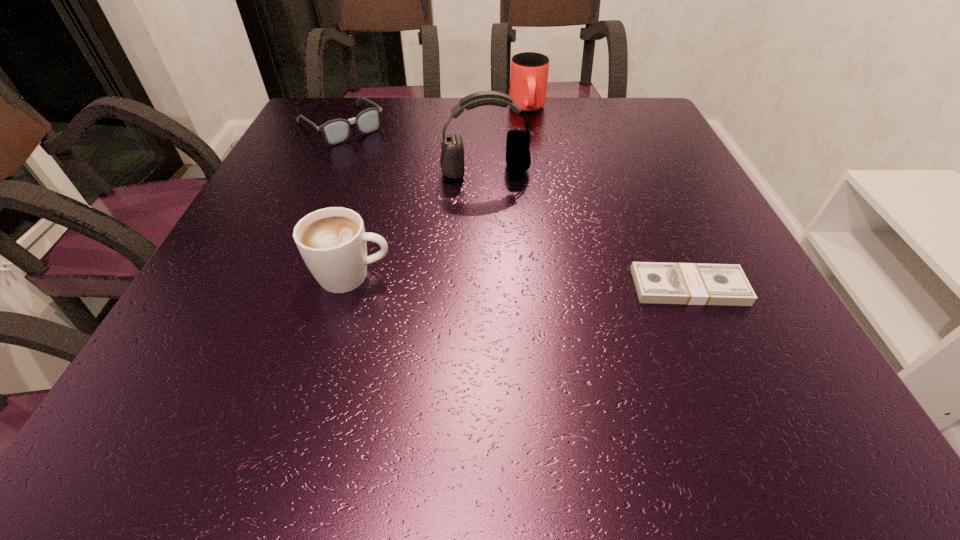
Locate an element on the screen. This screenshot has height=540, width=960. free point between the third farthest object and the spectacles is located at coordinates (414, 148).

Identify the location of vacant space that is in between the cup and the rightmost object. (608, 198).

Where is `free spot between the headset and the spectacles`? Image resolution: width=960 pixels, height=540 pixels. free spot between the headset and the spectacles is located at coordinates (414, 148).

This screenshot has height=540, width=960. I want to click on free space between the dollar and the cup, so click(608, 198).

Identify the location of free space between the cup and the cappuccino. This screenshot has height=540, width=960. (440, 193).

This screenshot has height=540, width=960. Find the location of `free space between the spectacles and the tallest object`. free space between the spectacles and the tallest object is located at coordinates (414, 148).

Find the location of a particular element. The width and height of the screenshot is (960, 540). free area in between the tallest object and the second shortest object is located at coordinates [x=414, y=148].

Locate which object ranks second in proximity to the third farthest object. Please provide its 2D coordinates. Your answer should be formatted as a tuple, i.e. [(x, y)], where the tuple contains the x and y coordinates of a point satisfying the conditions above.

[(529, 71)]

Where is `object that is the third closest to the headset`? object that is the third closest to the headset is located at coordinates (332, 241).